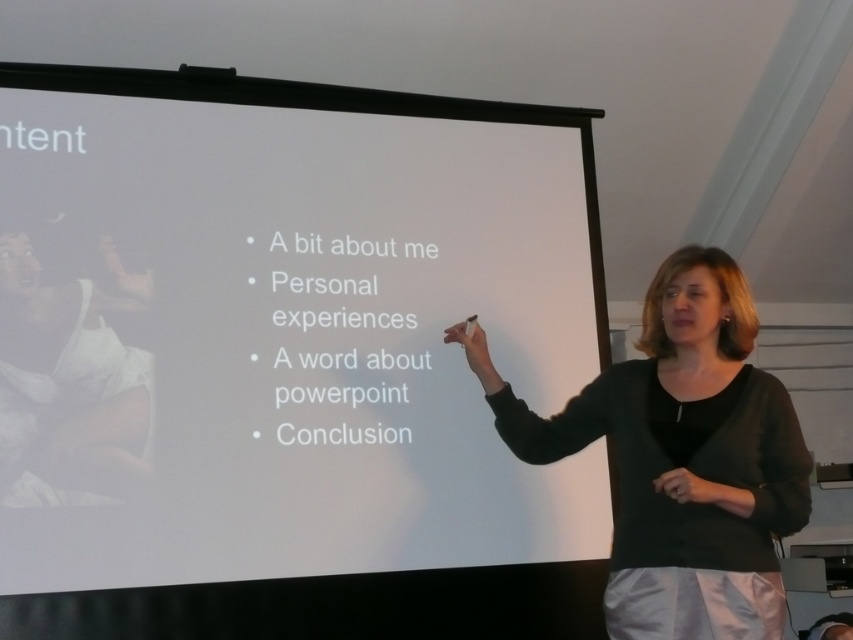
Question: Is white matte projection screen at center wider than black fabric at center?

Choices:
 (A) yes
 (B) no

Answer: (A)

Question: Is white matte projection screen at center wider than black fabric at center?

Choices:
 (A) yes
 (B) no

Answer: (A)

Question: Which object appears farthest from the camera in this image?

Choices:
 (A) white matte projection screen at center
 (B) black fabric at center

Answer: (A)

Question: Is white matte projection screen at center thinner than black fabric at center?

Choices:
 (A) yes
 (B) no

Answer: (B)